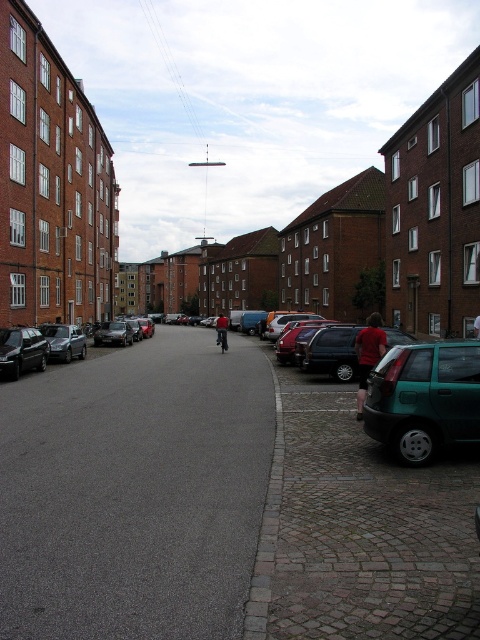
You are standing at the intersection ahead of the shiny black sedan at left. If you want to walk straight ahead, will you need to step into the road to avoid the parked cars on both sides?

The shiny black sedan at left is parked at position point (22, 349), which is along the left side of the street. Since parked cars line both sides of the street, walking straight ahead would require stepping into the road to avoid them.

You are a delivery person trying to deliver a package to a customer. You need to know if the red cotton shirt at center can fit into the trunk of the matte black car at center. Can you determine if it will fit based on their sizes?

The matte black car at center has a width that is less than the red cotton shirt at center, so the shirt may not fit into the car trunk.